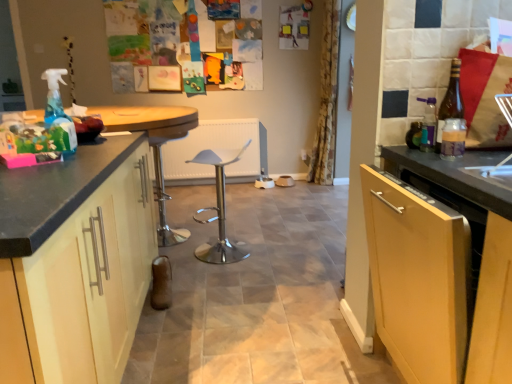
Find the location of a particular element. The width and height of the screenshot is (512, 384). vacant area that is in front of polished silver bar stool at center, positioned as the 1th bar stool in right-to-left order is located at coordinates (220, 276).